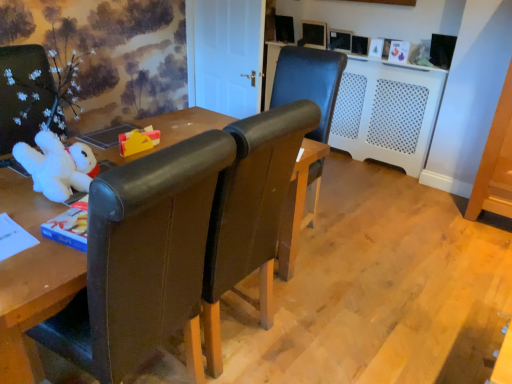
The width and height of the screenshot is (512, 384). Identify the location of free space to the left of white plush toy at left, which is the second toy in back-to-front order. (13, 190).